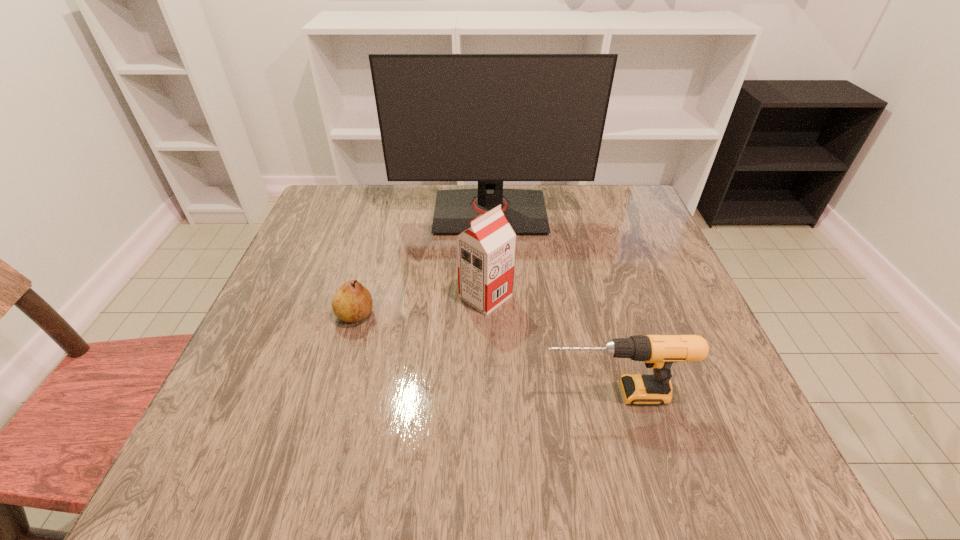
The height and width of the screenshot is (540, 960). I want to click on monitor, so coord(490,118).

Image resolution: width=960 pixels, height=540 pixels. Find the location of `the farthest object`. the farthest object is located at coordinates [490, 118].

Locate an element on the screen. The height and width of the screenshot is (540, 960). soya milk is located at coordinates (485, 252).

I want to click on the second shortest object, so click(658, 352).

You are a GUI agent. You are given a task and a screenshot of the screen. Output one action in this format:
    pyautogui.click(x=<x>, y=<y>)
    Task: Click on the drill
    The height and width of the screenshot is (540, 960).
    Given the screenshot: What is the action you would take?
    pyautogui.click(x=658, y=352)

At what (x,y) coordinates should I click in order to perform the action: click on the shortest object. Please return your answer as a coordinate pair (x, y). This screenshot has height=540, width=960. Looking at the image, I should click on (352, 302).

The image size is (960, 540). In order to click on vacant space located 0.320m on the screen side of the tallest object in this screenshot , I will do `click(493, 332)`.

Identify the location of free location located on the right of the soya milk. tap(599, 296).

At what (x,y) coordinates should I click in order to perform the action: click on vacant region located 0.190m on the handle side of the third tallest object. Please return your answer as a coordinate pair (x, y). The image size is (960, 540). Looking at the image, I should click on (435, 394).

This screenshot has height=540, width=960. Identify the location of vacant space located 0.180m on the handle side of the third tallest object. (441, 394).